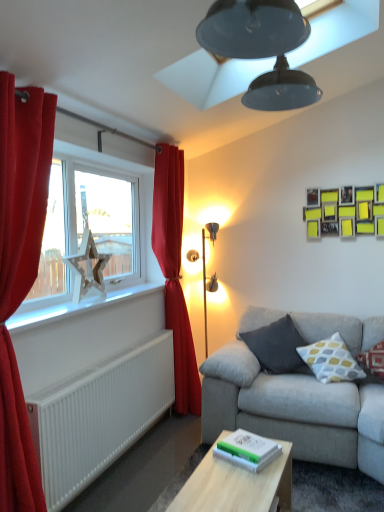
Image resolution: width=384 pixels, height=512 pixels. I want to click on vacant space underneath white textured radiator at lower left (from a real-world perspective), so click(127, 458).